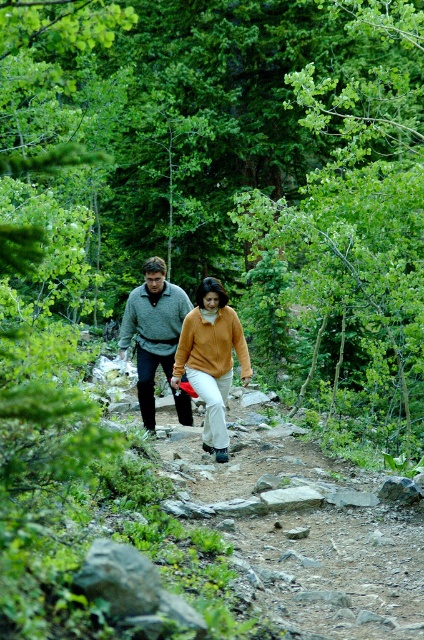
You are planning to take a photo of the two hikers wearing the matte orange sweater at center and the knit sweater at center. Which hiker should you focus on if you want to capture the one who is shorter?

The matte orange sweater at center is not as tall as knit sweater at center, so you should focus on the hiker wearing the matte orange sweater at center since they are shorter.

You are a hiker planning to take a photo of the two people on the trail. You want to ensure that both the matte orange sweater at center and the knit sweater at center are visible in the photo. Which sweater should you focus on to capture both clearly?

The matte orange sweater at center is below the knit sweater at center, so focusing on the knit sweater at center will ensure both are visible in the photo.

You are planning to wear a sweater for a hike and have two options in your backpack. The matte orange sweater at center and the knit sweater at center. Which sweater would be more comfortable for a narrow rocky trail?

The matte orange sweater at center is narrower than the knit sweater at center, so it might be more comfortable for a narrow rocky trail as it allows for better mobility.